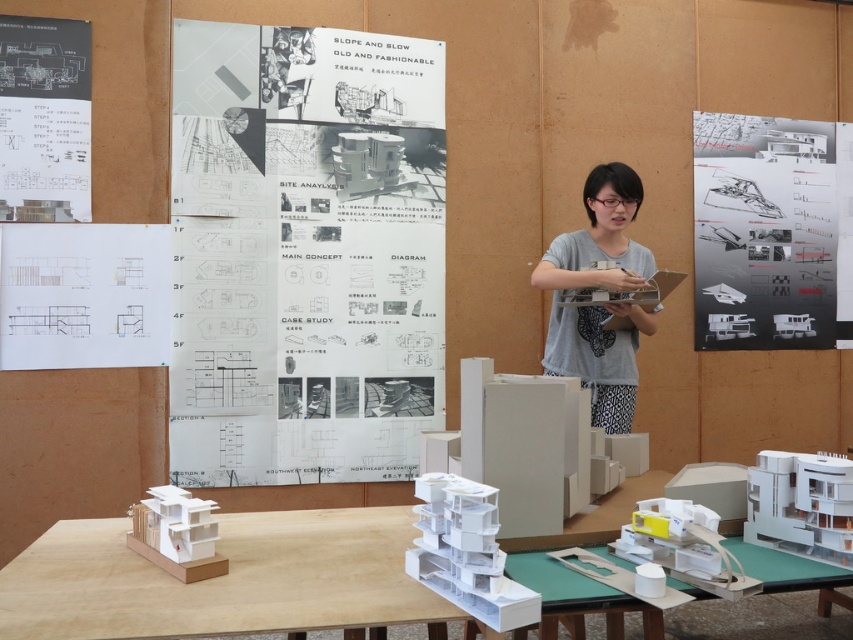
Question: Does white paper poster at center appear over gray cotton shirt at center?

Choices:
 (A) no
 (B) yes

Answer: (B)

Question: Which of these objects is positioned farthest from the white paper at left?

Choices:
 (A) white paper poster at center
 (B) white matte table at lower left
 (C) gray cotton shirt at center
 (D) white cardboard table at center

Answer: (D)

Question: Is white paper at left closer to the viewer compared to matte white paper at upper left?

Choices:
 (A) no
 (B) yes

Answer: (B)

Question: Which point is farther from the camera taking this photo?

Choices:
 (A) (628, 180)
 (B) (801, 561)
 (C) (13, 598)

Answer: (A)

Question: Is white paper at upper right wider than gray cotton shirt at center?

Choices:
 (A) no
 (B) yes

Answer: (B)

Question: Considering the real-world distances, which object is closest to the white matte table at lower left?

Choices:
 (A) white paper poster at center
 (B) matte white paper at upper left
 (C) white paper at upper right

Answer: (A)